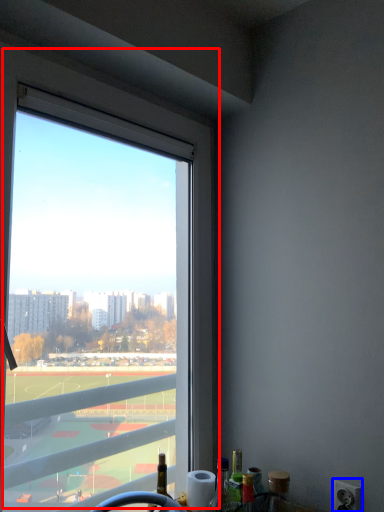
Question: Which of the following is the farthest to the observer, window (highlighted by a red box) or power outlet (highlighted by a blue box)?

Choices:
 (A) window
 (B) power outlet

Answer: (B)